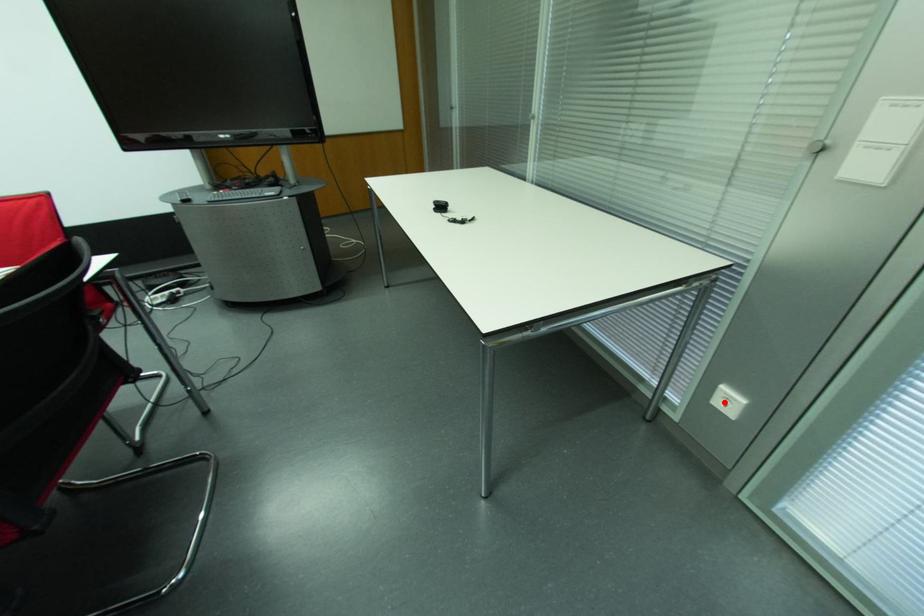
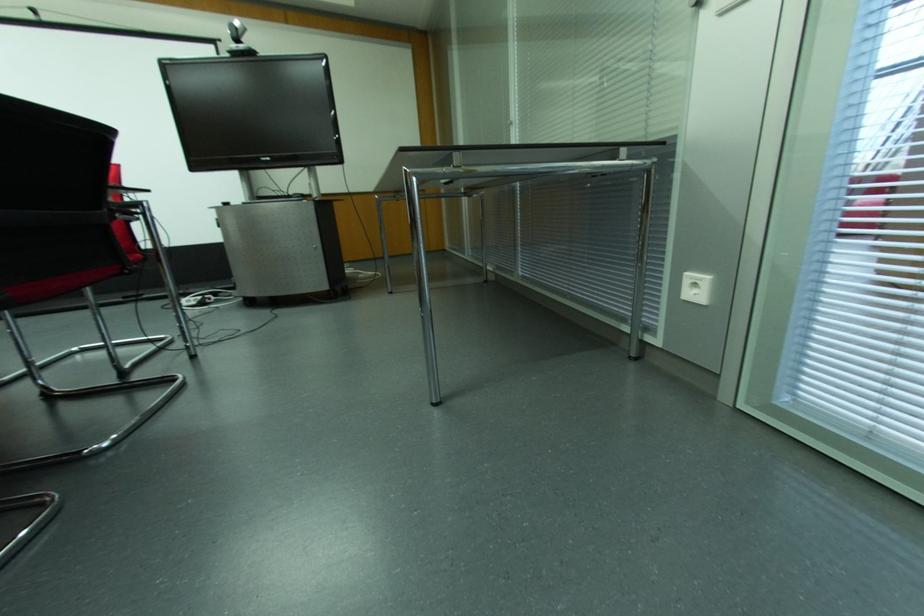
Where in the second image is the point corresponding to the highlighted location from the first image?

(694, 291)